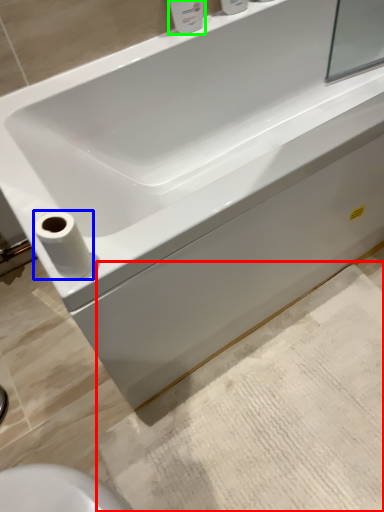
Question: Considering the real-world distances, which object is closest to bath mat (highlighted by a red box)? toilet paper (highlighted by a blue box) or toiletry (highlighted by a green box).

Choices:
 (A) toilet paper
 (B) toiletry

Answer: (A)